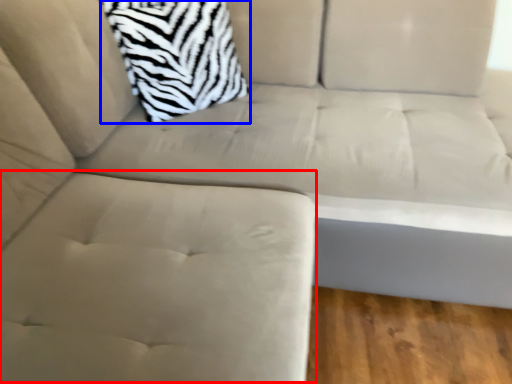
Question: Which object appears farthest to the camera in this image, swivel chair (highlighted by a red box) or throw pillow (highlighted by a blue box)?

Choices:
 (A) swivel chair
 (B) throw pillow

Answer: (B)